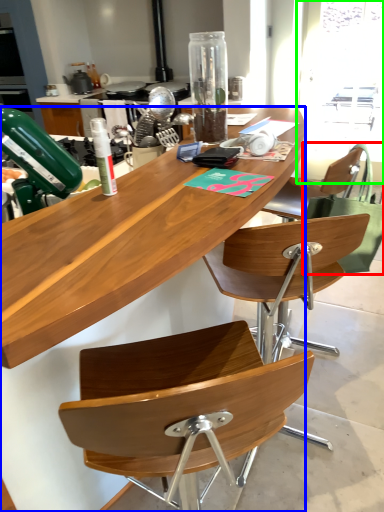
Question: Which object is the closest to the handbag (highlighted by a red box)? Choose among these: desk (highlighted by a blue box) or window screen (highlighted by a green box).

Choices:
 (A) desk
 (B) window screen

Answer: (A)